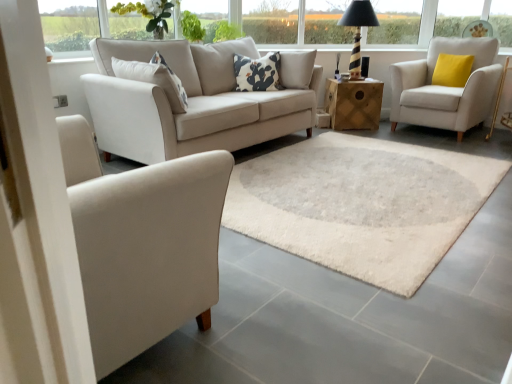
This screenshot has height=384, width=512. In order to click on free space to the right of matte white armchair at left, placed as the 2th chair when sorted from right to left in this screenshot , I will do `click(293, 302)`.